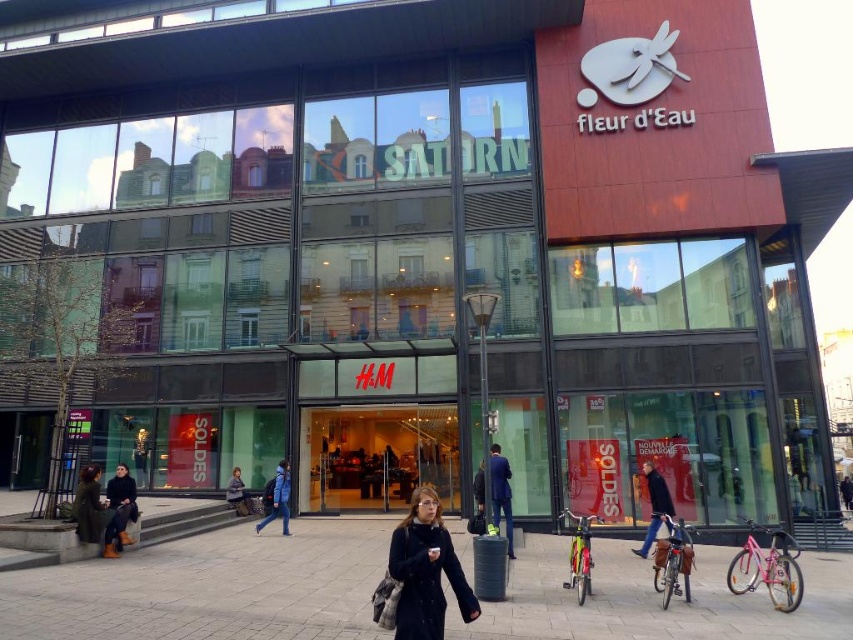
Question: Among these points, which one is nearest to the camera?

Choices:
 (A) (432, 564)
 (B) (256, 525)
 (C) (663, 509)

Answer: (A)

Question: From the image, what is the correct spatial relationship of smooth concrete pavement at center in relation to black matte coat at center?

Choices:
 (A) left
 (B) right

Answer: (B)

Question: Is smooth concrete pavement at center behind leather boots at lower left?

Choices:
 (A) yes
 (B) no

Answer: (B)

Question: From the image, what is the correct spatial relationship of black matte coat at center in relation to leather boots at lower left?

Choices:
 (A) right
 (B) left

Answer: (A)

Question: Based on their relative distances, which object is farther from the dark gray coat at lower center?

Choices:
 (A) dark blue jeans at center
 (B) blue fabric jacket at center
 (C) leather boots at lower left
 (D) black matte coat at center

Answer: (D)

Question: Which of these objects is positioned farthest from the smooth concrete pavement at center?

Choices:
 (A) dark gray coat at lower center
 (B) blue fabric jacket at center

Answer: (A)